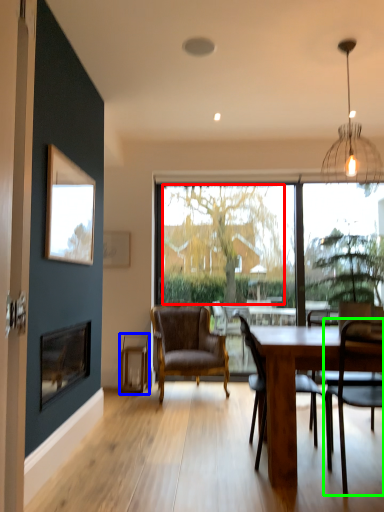
Question: Based on their relative distances, which object is farther from tree (highlighted by a red box)? Choose from plank (highlighted by a blue box) and chair (highlighted by a green box).

Choices:
 (A) plank
 (B) chair

Answer: (B)